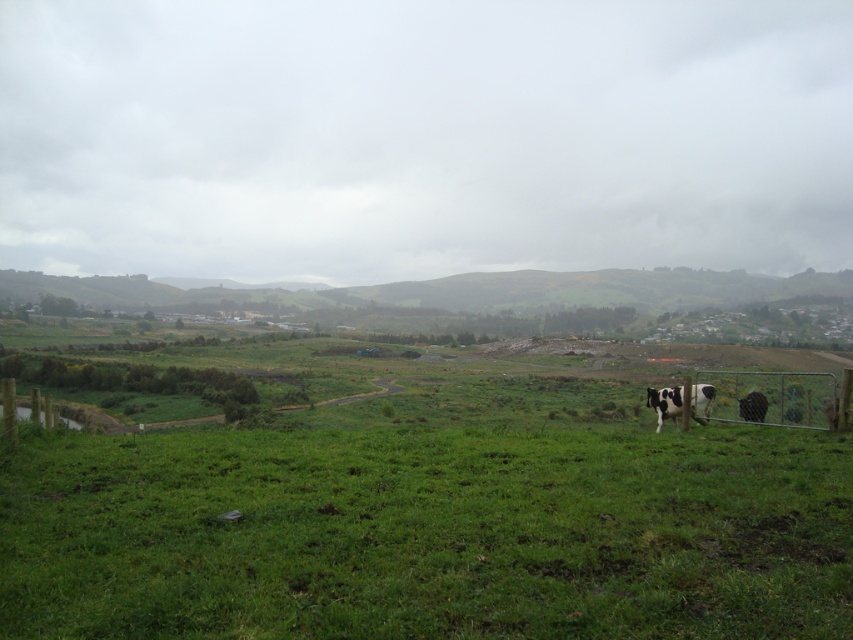
Does point (717, 378) come closer to viewer compared to point (746, 410)?

No.

Is metal chain-link fence at lower right taller than black and white spotted cow at right?

Correct, metal chain-link fence at lower right is much taller as black and white spotted cow at right.

Does point (796, 372) come closer to viewer compared to point (759, 403)?

No.

You are a GUI agent. You are given a task and a screenshot of the screen. Output one action in this format:
    pyautogui.click(x=<x>, y=<y>)
    Task: Click on the metal chain-link fence at lower right
    This screenshot has width=853, height=640.
    Given the screenshot: What is the action you would take?
    pyautogui.click(x=772, y=397)

Which is above, black and white spotted cow at lower right or black and white spotted cow at right?

black and white spotted cow at right is higher up.

Does point (706, 394) lie behind point (740, 416)?

Yes, it is.

You are a GUI agent. You are given a task and a screenshot of the screen. Output one action in this format:
    pyautogui.click(x=<x>, y=<y>)
    Task: Click on the black and white spotted cow at lower right
    The height and width of the screenshot is (640, 853).
    Given the screenshot: What is the action you would take?
    pyautogui.click(x=665, y=403)

Which is more to the right, metal chain-link fence at lower right or black and white spotted cow at lower right?

metal chain-link fence at lower right is more to the right.

Who is taller, metal chain-link fence at lower right or black and white spotted cow at lower right?

metal chain-link fence at lower right

This screenshot has height=640, width=853. Find the location of `metal chain-link fence at lower right`. metal chain-link fence at lower right is located at coordinates (772, 397).